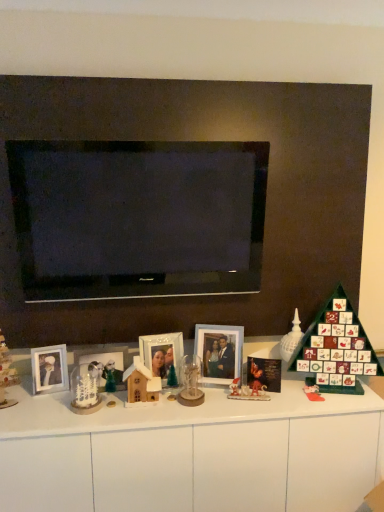
This screenshot has width=384, height=512. I want to click on free space to the left of white frosted glass candle holder at lower left, arranged as the 2th candle holder when viewed from the right, so click(44, 408).